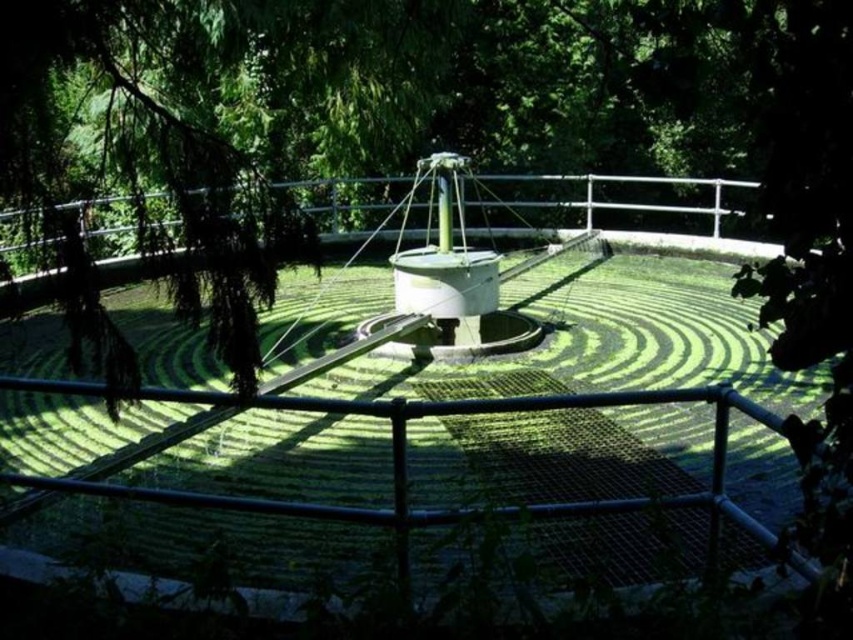
Question: Can you confirm if green grass at center is positioned above metallic silver rail at center?

Choices:
 (A) yes
 (B) no

Answer: (B)

Question: Is green grass at center thinner than metallic silver rail at center?

Choices:
 (A) no
 (B) yes

Answer: (B)

Question: Does green grass at center have a smaller size compared to metallic silver rail at center?

Choices:
 (A) yes
 (B) no

Answer: (A)